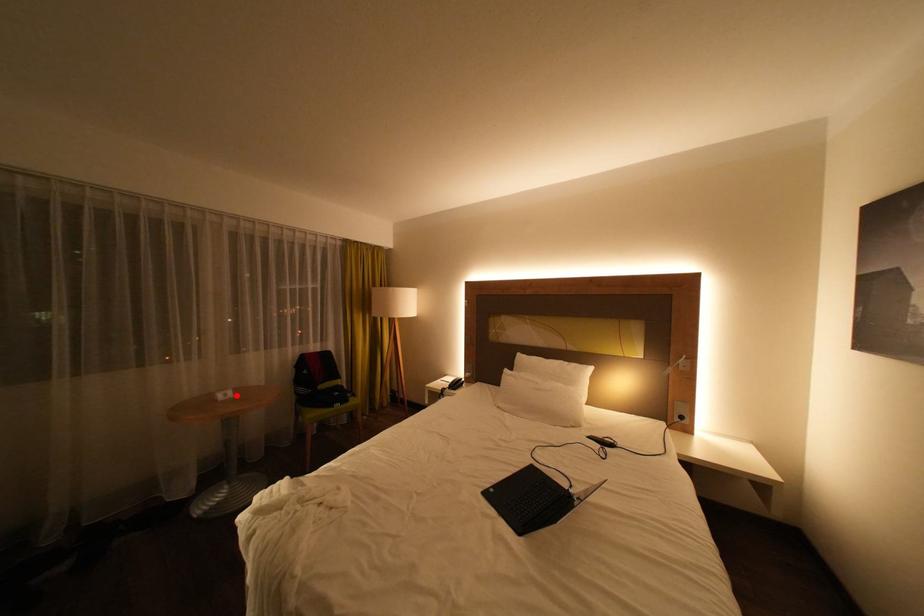
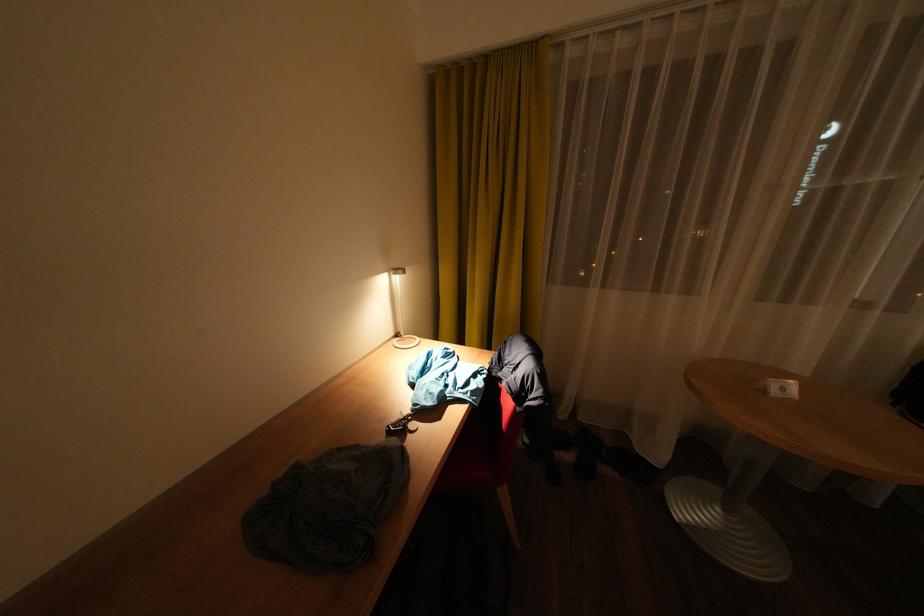
Where in the second image is the point corresponding to the highlighted location from the first image?

(794, 390)